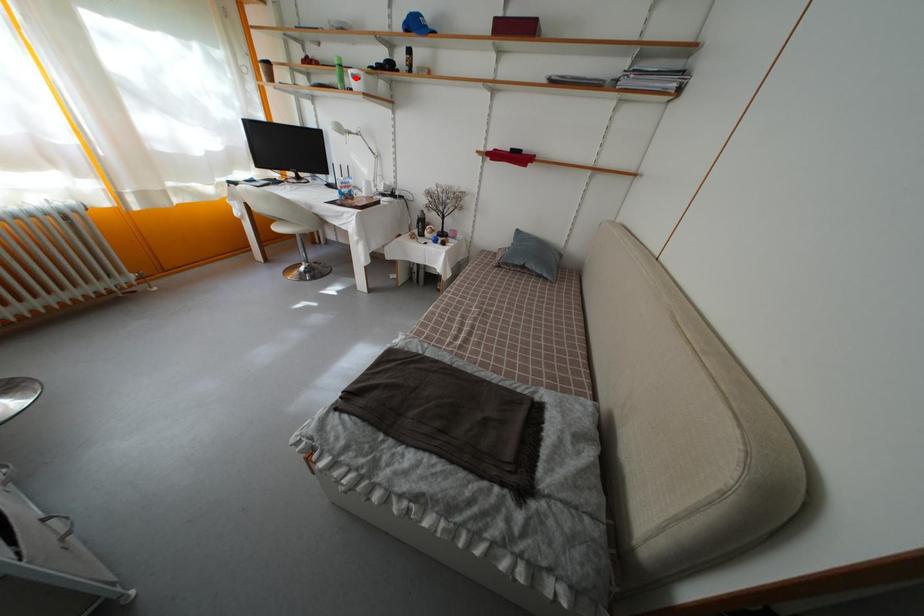
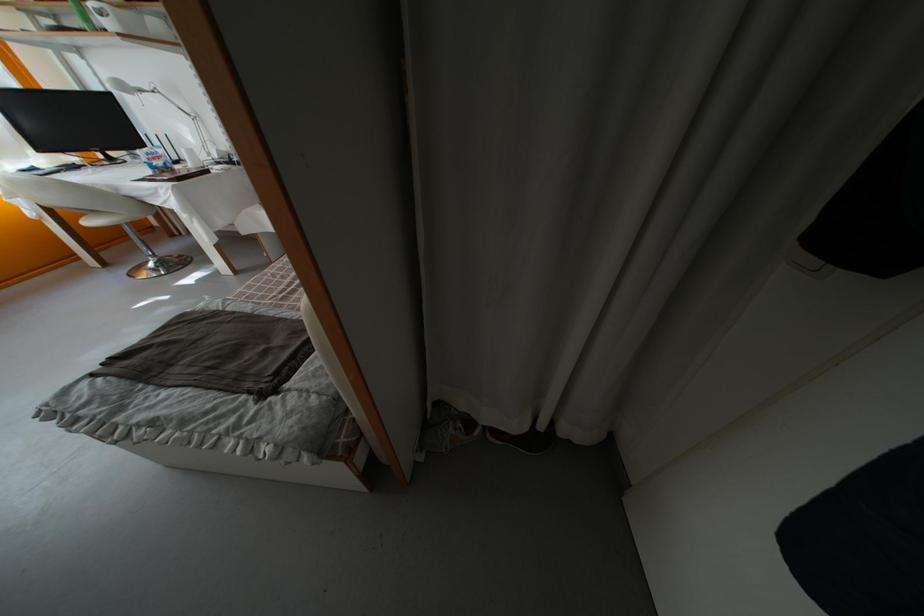
Question: I am providing you with two images of the same scene from different viewpoints. Image1 has a red point marked. In image2, the corresponding 3D location appears at what relative position? Reply with the corresponding letter.

Choices:
 (A) Closer
 (B) Farther

Answer: (B)